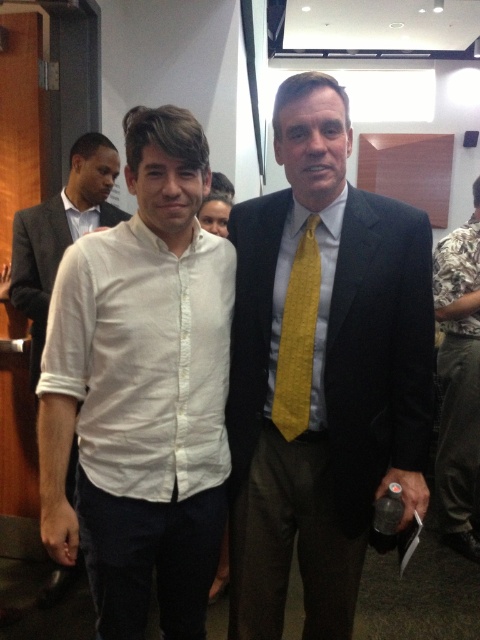
You are standing in a room and see a white linen shirt at center. If you want to reach out and touch it, will you be able to do so without moving your feet?

The white linen shirt at center is 1.17 meters away from viewer. Since the average human arm span is about 1.5 meters, you can likely reach it without moving your feet.

You are at a formal event and need to identify the clothing items worn by the two people in the image. Which clothing item is located lower on the body between the camouflage fabric shirt at center and the yellow woven tie at center?

The camouflage fabric shirt at center is positioned under the yellow woven tie at center, so it is located lower on the body.